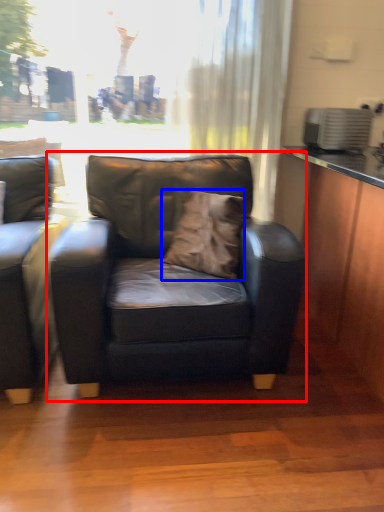
Question: Which of the following is the closest to the observer, chair (highlighted by a red box) or pillow (highlighted by a blue box)?

Choices:
 (A) chair
 (B) pillow

Answer: (A)